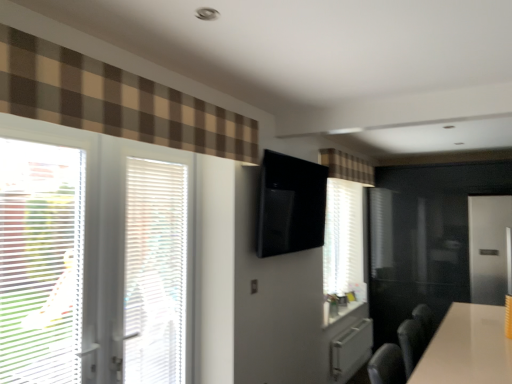
What do you see at coordinates (114, 100) in the screenshot? I see `brown checkered curtain at upper left, acting as the 2th curtain starting from the back` at bounding box center [114, 100].

What do you see at coordinates (40, 262) in the screenshot?
I see `white plastic blinds at left, which appears as the first window when viewed from the left` at bounding box center [40, 262].

In order to face satin silver screen door at right, should I rotate leftwards or rightwards?

Turn right approximately 29.056 degrees to face it.

The width and height of the screenshot is (512, 384). Describe the element at coordinates (155, 271) in the screenshot. I see `white plastic blinds at left` at that location.

Find the location of a particular element. The height and width of the screenshot is (384, 512). brown checkered curtain at upper left, acting as the 2th curtain starting from the back is located at coordinates (114, 100).

Is white plastic blinds at left inside brown checkered curtain at upper left, acting as the 2th curtain starting from the back?

No, brown checkered curtain at upper left, acting as the 2th curtain starting from the back, does not contain white plastic blinds at left.

Considering the relative sizes of brown checkered curtain at upper left, which is the second curtain from right to left, and white plastic blinds at left in the image provided, is brown checkered curtain at upper left, which is the second curtain from right to left, wider than white plastic blinds at left?

Indeed, brown checkered curtain at upper left, which is the second curtain from right to left, has a greater width compared to white plastic blinds at left.

Locate an element on the screen. curtain that is in front of the white plastic blinds at left is located at coordinates (114, 100).

Between white plastic blinds at left and brown checkered curtain at upper left, which is the second curtain from right to left, which one has smaller width?

white plastic blinds at left is thinner.

Locate an element on the screen. blind below the brown checkered curtain at upper left, which is the 1th curtain in front-to-back order (from a real-world perspective) is located at coordinates (155, 271).

From a real-world perspective, which is physically above, white plastic blinds at left or brown checkered curtain at upper left, the first curtain positioned from the left?

In real-world perspective, brown checkered curtain at upper left, the first curtain positioned from the left, is above.

Which is correct: white plastic blinds at left is inside brown checkered curtain at upper left, which is the 1th curtain in front-to-back order, or outside of it?

white plastic blinds at left lies outside brown checkered curtain at upper left, which is the 1th curtain in front-to-back order.

Which object is wider, white plastic blinds at left, marked as the second window in a right-to-left arrangement, or brown plaid curtain at upper center, placed as the 2th curtain when sorted from left to right?

brown plaid curtain at upper center, placed as the 2th curtain when sorted from left to right, is wider.

Would you say white plastic blinds at left, marked as the second window in a right-to-left arrangement, is a long distance from brown plaid curtain at upper center, the first curtain positioned from the right?

white plastic blinds at left, marked as the second window in a right-to-left arrangement, is positioned a significant distance from brown plaid curtain at upper center, the first curtain positioned from the right.

Would you say brown plaid curtain at upper center, the first curtain positioned from the right, is part of white plastic blinds at left, which appears as the first window when viewed from the left,'s contents?

No, white plastic blinds at left, which appears as the first window when viewed from the left, does not contain brown plaid curtain at upper center, the first curtain positioned from the right.

Considering the relative positions of white plastic blinds at left, which appears as the first window when viewed from the left, and brown plaid curtain at upper center, which ranks as the 1th curtain in back-to-front order, in the image provided, is white plastic blinds at left, which appears as the first window when viewed from the left, to the left or to the right of brown plaid curtain at upper center, which ranks as the 1th curtain in back-to-front order,?

white plastic blinds at left, which appears as the first window when viewed from the left, is positioned on brown plaid curtain at upper center, which ranks as the 1th curtain in back-to-front order,'s left side.

Which of these two, white plastic blinds at left or white glossy table at lower right, is smaller?

white plastic blinds at left.

In terms of height, does white plastic blinds at left look taller or shorter compared to white glossy table at lower right?

Considering their sizes, white plastic blinds at left has more height than white glossy table at lower right.

Is white plastic blinds at left thinner than white glossy table at lower right?

Yes, white plastic blinds at left is thinner than white glossy table at lower right.

Is white plastic blinds at left far away from white glossy table at lower right?

white plastic blinds at left is positioned a significant distance from white glossy table at lower right.

From the image's perspective, is white textured blinds at left, which is counted as the second window, starting from the left, located above or below brown checkered curtain at upper left, which is the second curtain from right to left?

white textured blinds at left, which is counted as the second window, starting from the left, is below brown checkered curtain at upper left, which is the second curtain from right to left.

Can you confirm if white textured blinds at left, which is counted as the second window, starting from the left, is positioned to the left of brown checkered curtain at upper left, the first curtain positioned from the left?

Indeed, white textured blinds at left, which is counted as the second window, starting from the left, is positioned on the left side of brown checkered curtain at upper left, the first curtain positioned from the left.

What's the angular difference between white textured blinds at left, acting as the first window starting from the right, and brown checkered curtain at upper left, the first curtain positioned from the left,'s facing directions?

white textured blinds at left, acting as the first window starting from the right, and brown checkered curtain at upper left, the first curtain positioned from the left, are facing 0.517 degrees away from each other.

Considering the relative sizes of white textured blinds at left, acting as the first window starting from the right, and brown checkered curtain at upper left, the first curtain positioned from the left, in the image provided, is white textured blinds at left, acting as the first window starting from the right, thinner than brown checkered curtain at upper left, the first curtain positioned from the left,?

Yes.

From the image's perspective, would you say brown plaid curtain at upper center, placed as the 2th curtain when sorted from front to back, is positioned over white plastic blinds at left, marked as the second window in a right-to-left arrangement?

Yes.

From a real-world perspective, is brown plaid curtain at upper center, placed as the 2th curtain when sorted from left to right, positioned under white plastic blinds at left, marked as the second window in a right-to-left arrangement, based on gravity?

No, from a real-world perspective, brown plaid curtain at upper center, placed as the 2th curtain when sorted from left to right, is not below white plastic blinds at left, marked as the second window in a right-to-left arrangement.

I want to click on curtain behind the white plastic blinds at left, which appears as the first window when viewed from the left, so click(347, 166).

Can you tell me how much white textured blinds at left, which is counted as the second window, starting from the left, and white plastic blinds at left, marked as the second window in a right-to-left arrangement, differ in facing direction?

There is a 0.0022-degree angle between the facing directions of white textured blinds at left, which is counted as the second window, starting from the left, and white plastic blinds at left, marked as the second window in a right-to-left arrangement.

The image size is (512, 384). I want to click on window below the white plastic blinds at left, which appears as the first window when viewed from the left (from a real-world perspective), so click(x=91, y=257).

Is white textured blinds at left, acting as the first window starting from the right, at the left side of white plastic blinds at left, which appears as the first window when viewed from the left?

In fact, white textured blinds at left, acting as the first window starting from the right, is to the right of white plastic blinds at left, which appears as the first window when viewed from the left.

Is white textured blinds at left, which is counted as the second window, starting from the left, aimed at white plastic blinds at left, which appears as the first window when viewed from the left?

Yes, white textured blinds at left, which is counted as the second window, starting from the left, is facing white plastic blinds at left, which appears as the first window when viewed from the left.

I want to click on blind behind the brown checkered curtain at upper left, which is the second curtain from right to left, so click(x=155, y=271).

The width and height of the screenshot is (512, 384). There is a white plastic blinds at left. In order to click on the 1st curtain above it (from a real-world perspective) in this screenshot , I will do `click(114, 100)`.

Which object lies nearer to the anchor point white plastic blinds at left, marked as the second window in a right-to-left arrangement, white textured blinds at left, which is counted as the second window, starting from the left, or brown plaid curtain at upper center, the first curtain positioned from the right?

Among the two, white textured blinds at left, which is counted as the second window, starting from the left, is located nearer to white plastic blinds at left, marked as the second window in a right-to-left arrangement.

Estimate the real-world distances between objects in this image. Which object is closer to satin silver screen door at right, white textured blinds at left, acting as the first window starting from the right, or white glossy table at lower right?

Among the two, white glossy table at lower right is located nearer to satin silver screen door at right.

When comparing their distances from white plastic blinds at left, which appears as the first window when viewed from the left, does satin silver screen door at right or brown plaid curtain at upper center, placed as the 2th curtain when sorted from left to right, seem closer?

The object closer to white plastic blinds at left, which appears as the first window when viewed from the left, is brown plaid curtain at upper center, placed as the 2th curtain when sorted from left to right.

Based on their spatial positions, is brown checkered curtain at upper left, which is the 1th curtain in front-to-back order, or white plastic blinds at left closer to white plastic blinds at left, marked as the second window in a right-to-left arrangement?

Among the two, white plastic blinds at left is located nearer to white plastic blinds at left, marked as the second window in a right-to-left arrangement.

Looking at the image, which one is located closer to satin silver screen door at right, brown checkered curtain at upper left, the first curtain positioned from the left, or brown plaid curtain at upper center, the first curtain positioned from the right?

Based on the image, brown plaid curtain at upper center, the first curtain positioned from the right, appears to be nearer to satin silver screen door at right.

In the scene shown: When comparing their distances from white textured blinds at left, acting as the first window starting from the right, does white plastic blinds at left or white plastic blinds at left, which appears as the first window when viewed from the left, seem closer?

Among the two, white plastic blinds at left is located nearer to white textured blinds at left, acting as the first window starting from the right.

Considering their positions, is white glossy table at lower right positioned closer to white textured blinds at left, acting as the first window starting from the right, than brown checkered curtain at upper left, the first curtain positioned from the left?

brown checkered curtain at upper left, the first curtain positioned from the left, is closer to white textured blinds at left, acting as the first window starting from the right.

From the image, which object appears to be nearer to white plastic blinds at left, white plastic blinds at left, which appears as the first window when viewed from the left, or white textured blinds at left, acting as the first window starting from the right?

white textured blinds at left, acting as the first window starting from the right.

The height and width of the screenshot is (384, 512). Find the location of `blind between white plastic blinds at left, marked as the second window in a right-to-left arrangement, and satin silver screen door at right from left to right`. blind between white plastic blinds at left, marked as the second window in a right-to-left arrangement, and satin silver screen door at right from left to right is located at coordinates (155, 271).

Find the location of a particular element. The image size is (512, 384). window between white plastic blinds at left, marked as the second window in a right-to-left arrangement, and satin silver screen door at right is located at coordinates (91, 257).

Identify the location of curtain between brown checkered curtain at upper left, which is the 1th curtain in front-to-back order, and satin silver screen door at right, along the z-axis. The height and width of the screenshot is (384, 512). (347, 166).

Where is `window located between white textured blinds at left, acting as the first window starting from the right, and white plastic blinds at left in the depth direction`? Image resolution: width=512 pixels, height=384 pixels. window located between white textured blinds at left, acting as the first window starting from the right, and white plastic blinds at left in the depth direction is located at coordinates (40, 262).